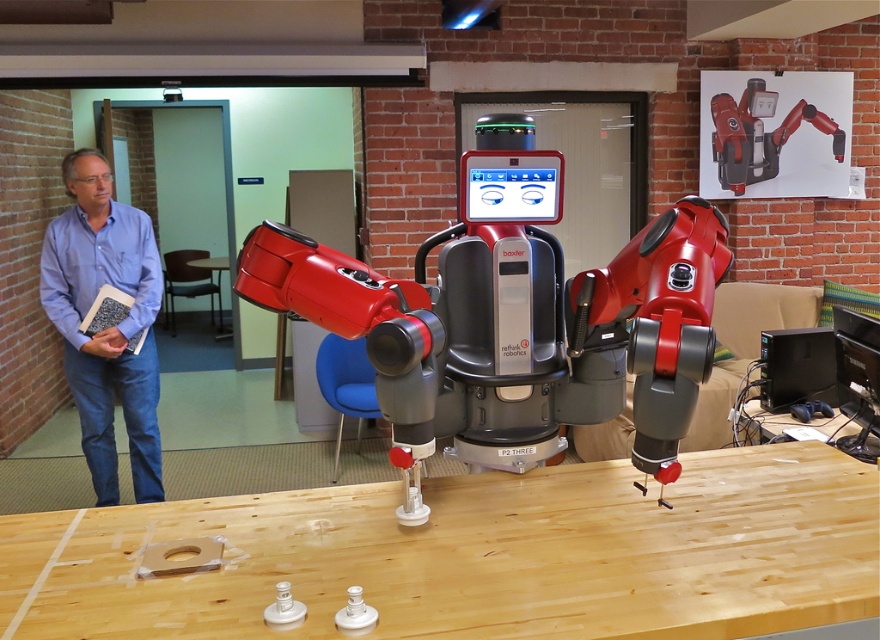
Question: Which is nearer to the matte black robotic arm at upper center?

Choices:
 (A) metallic red robot at center
 (B) wooden table at center
 (C) brown leather chair at center
 (D) blue plastic chair at center

Answer: (D)

Question: Estimate the real-world distances between objects in this image. Which object is farther from the matte black robotic arm at upper center?

Choices:
 (A) light brown wood table at center
 (B) blue plastic chair at center

Answer: (A)

Question: Estimate the real-world distances between objects in this image. Which object is closer to the brown leather chair at center?

Choices:
 (A) light brown wood table at center
 (B) blue denim jeans at left
 (C) metallic red robot at center

Answer: (B)

Question: Does blue plastic chair at center appear on the right side of brown leather chair at center?

Choices:
 (A) yes
 (B) no

Answer: (A)

Question: Considering the relative positions of blue plastic chair at center and wooden table at center in the image provided, where is blue plastic chair at center located with respect to wooden table at center?

Choices:
 (A) above
 (B) below

Answer: (B)

Question: Is brown leather chair at center closer to camera compared to wooden table at center?

Choices:
 (A) no
 (B) yes

Answer: (A)